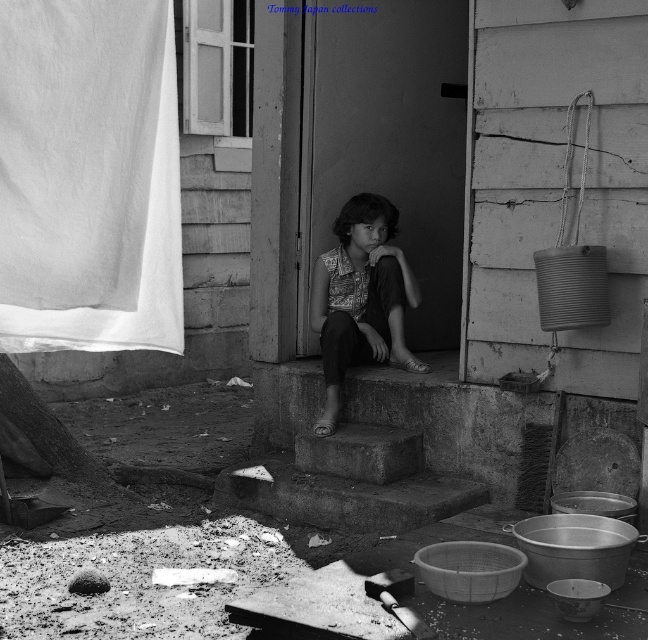
You are an interior designer planning to place a large decorative item on the white cotton cloth at left and the concrete stairs at center. Based on their sizes, which location would be more suitable for the item?

The concrete stairs at center would be more suitable for placing the large decorative item since the white cotton cloth at left occupies less space and may not provide enough area to support it.

You are an observer standing in front of the house. Which object is nearer to you between the white cotton cloth at left and the patterned fabric shirt at center?

The white cotton cloth at left is closer to the viewer than the patterned fabric shirt at center.

You are a photographer adjusting the focus of your camera. You want to capture both the concrete stairs at center and the patterned fabric shirt at center in sharp focus. Given that your camera can only focus on objects within a 15 inch range, will both objects be in focus?

The concrete stairs at center and patterned fabric shirt at center are 20.49 inches apart from each other. Since the distance between them exceeds the camera focus range of 15 inches, both objects cannot be in focus simultaneously.